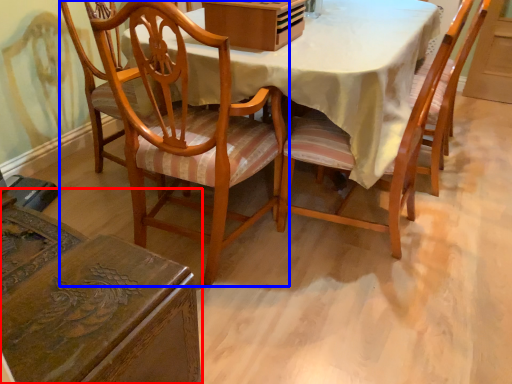
Question: Which object appears closest to the camera in this image, chair (highlighted by a red box) or chair (highlighted by a blue box)?

Choices:
 (A) chair
 (B) chair

Answer: (A)